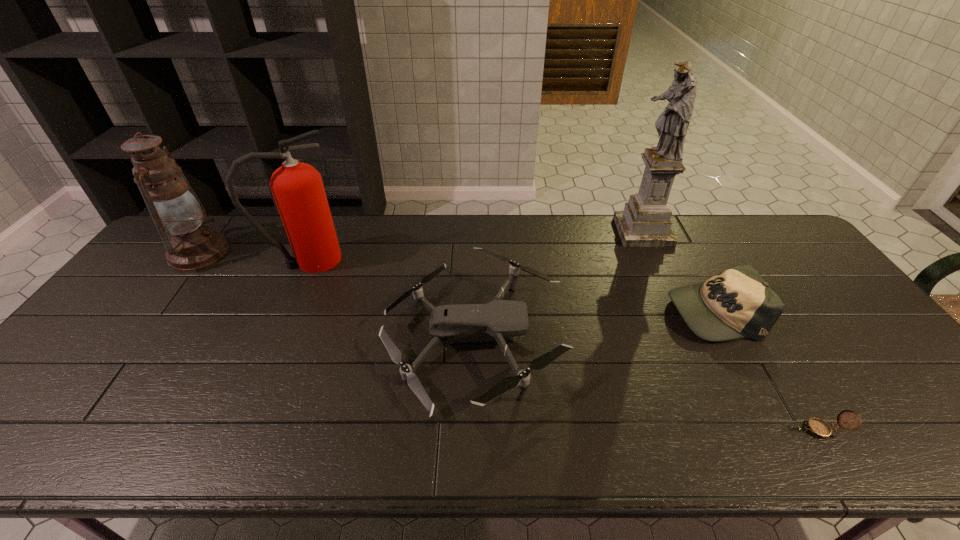
This screenshot has width=960, height=540. Identify the location of free point between the drone and the leftmost object. (336, 296).

Image resolution: width=960 pixels, height=540 pixels. What are the coordinates of `free area in between the sculpture and the baseball cap` in the screenshot? It's located at 678,272.

Locate an element on the screen. This screenshot has height=540, width=960. blank region between the baseball cap and the compass is located at coordinates (767, 370).

Where is `blank region between the second object from left to right and the fourth object from right to left`? This screenshot has width=960, height=540. blank region between the second object from left to right and the fourth object from right to left is located at coordinates (391, 300).

The height and width of the screenshot is (540, 960). I want to click on free space between the oil lamp and the baseball cap, so click(456, 282).

The height and width of the screenshot is (540, 960). I want to click on blank region between the baseball cap and the sculpture, so click(x=678, y=272).

You are a GUI agent. You are given a task and a screenshot of the screen. Output one action in this format:
    pyautogui.click(x=<x>, y=<y>)
    Task: Click on the object that is the fifth closest to the baseball cap
    
    Given the screenshot: What is the action you would take?
    coord(191,244)

Identify the location of the closest object to the compass. The image size is (960, 540). (736, 303).